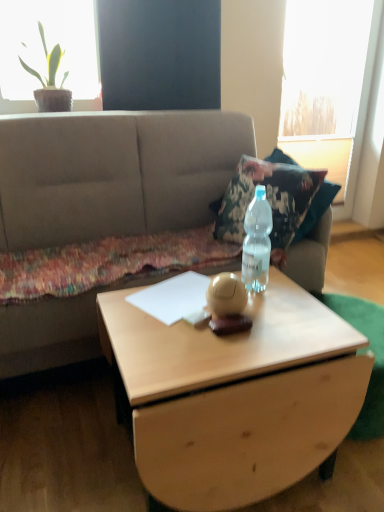
Question: From the image's perspective, is green leafy plant at upper left positioned above or below clear plastic bottle at center?

Choices:
 (A) below
 (B) above

Answer: (B)

Question: Is green leafy plant at upper left wider or thinner than clear plastic bottle at center?

Choices:
 (A) wide
 (B) thin

Answer: (A)

Question: Estimate the real-world distances between objects in this image. Which object is closer to the beige fabric couch at center?

Choices:
 (A) green leafy plant at upper left
 (B) light wood coffee table at center
 (C) clear plastic bottle at center
 (D) transparent glass window at upper right

Answer: (A)

Question: Which of these objects is positioned farthest from the transparent glass window at upper right?

Choices:
 (A) clear plastic bottle at center
 (B) light wood coffee table at center
 (C) beige fabric couch at center
 (D) green leafy plant at upper left

Answer: (B)